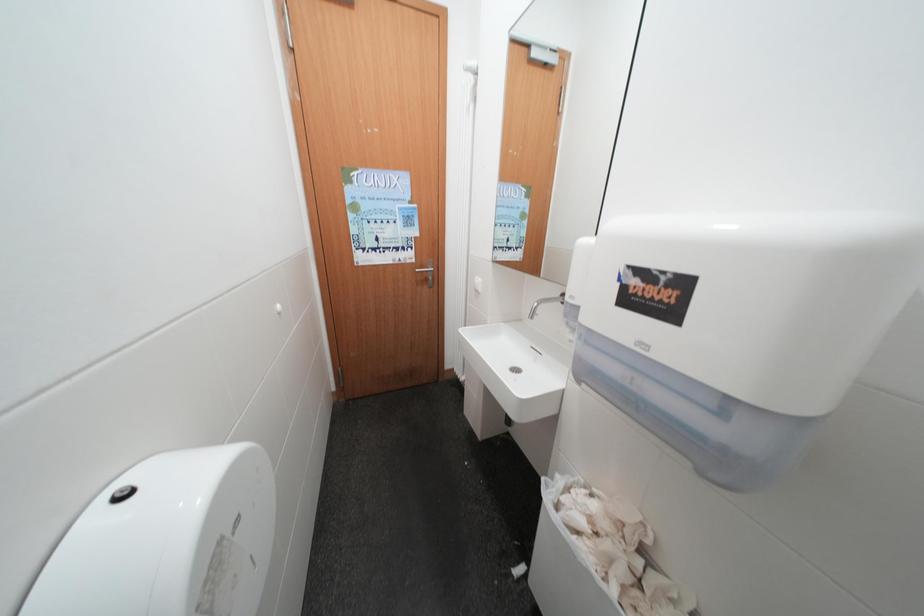
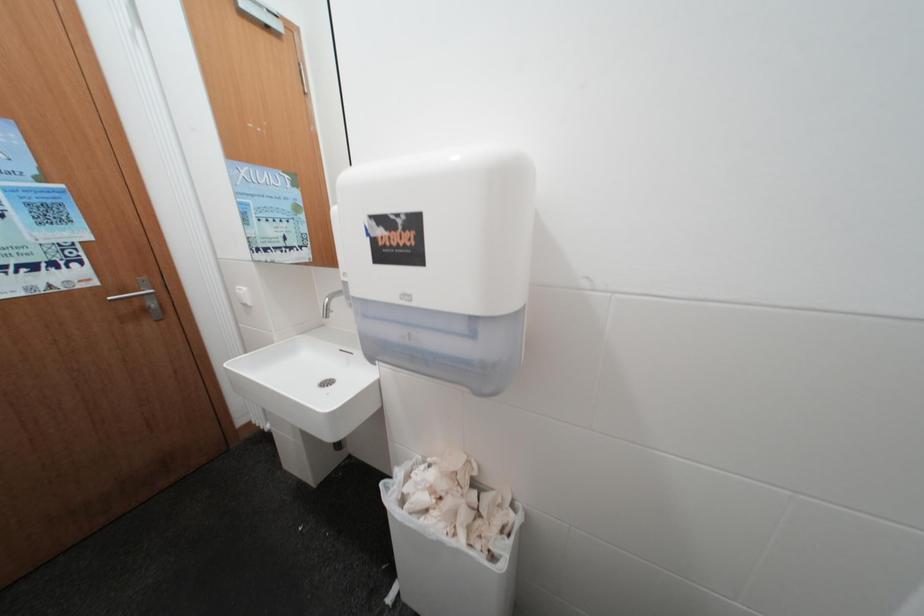
Question: The images are taken continuously from a first-person perspective. In which direction is your viewpoint rotating?

Choices:
 (A) Left
 (B) Right
 (C) Up
 (D) Down

Answer: (B)